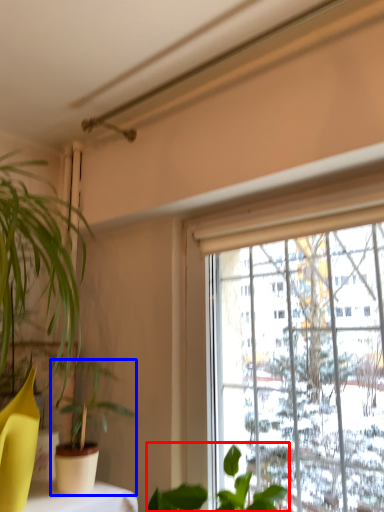
Question: Among these objects, which one is nearest to the camera, houseplant (highlighted by a red box) or houseplant (highlighted by a blue box)?

Choices:
 (A) houseplant
 (B) houseplant

Answer: (A)